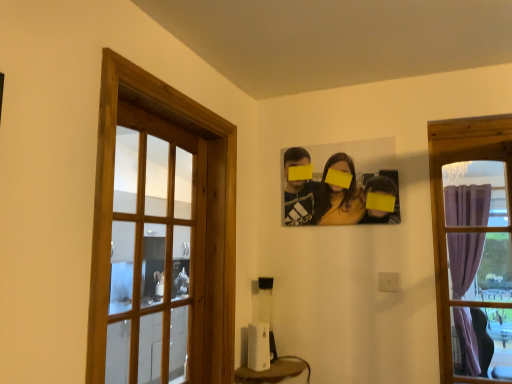
Question: From the image's perspective, is white plastic speaker at lower center located beneath purple curtain at right, the second window in the left-to-right sequence?

Choices:
 (A) yes
 (B) no

Answer: (A)

Question: From a real-world perspective, is white plastic speaker at lower center positioned over purple curtain at right, the second window in the left-to-right sequence, based on gravity?

Choices:
 (A) no
 (B) yes

Answer: (A)

Question: From a real-world perspective, is white plastic speaker at lower center beneath purple curtain at right, placed as the first window when sorted from right to left?

Choices:
 (A) yes
 (B) no

Answer: (A)

Question: Can you confirm if white plastic speaker at lower center is smaller than purple curtain at right, the second window in the left-to-right sequence?

Choices:
 (A) yes
 (B) no

Answer: (A)

Question: Is white plastic speaker at lower center wider than purple curtain at right, the second window in the left-to-right sequence?

Choices:
 (A) yes
 (B) no

Answer: (A)

Question: Is purple curtain at right, the second window in the left-to-right sequence, inside or outside of wooden frame at left, the 1th window from the left?

Choices:
 (A) outside
 (B) inside

Answer: (A)

Question: Considering the positions of purple curtain at right, placed as the first window when sorted from right to left, and wooden frame at left, the 1th window from the left, in the image, is purple curtain at right, placed as the first window when sorted from right to left, wider or thinner than wooden frame at left, the 1th window from the left,?

Choices:
 (A) thin
 (B) wide

Answer: (A)

Question: From a real-world perspective, relative to wooden frame at left, the 1th window from the left, is purple curtain at right, the second window in the left-to-right sequence, vertically above or below?

Choices:
 (A) below
 (B) above

Answer: (B)

Question: Is point (445, 147) positioned closer to the camera than point (223, 379)?

Choices:
 (A) farther
 (B) closer

Answer: (A)

Question: In the image, is white plastic speaker at lower center positioned in front of or behind purple curtain at right, the second window in the left-to-right sequence?

Choices:
 (A) front
 (B) behind

Answer: (B)

Question: Considering the positions of white plastic speaker at lower center and purple curtain at right, placed as the first window when sorted from right to left, in the image, is white plastic speaker at lower center bigger or smaller than purple curtain at right, placed as the first window when sorted from right to left,?

Choices:
 (A) big
 (B) small

Answer: (B)

Question: Considering the positions of white plastic speaker at lower center and purple curtain at right, the second window in the left-to-right sequence, in the image, is white plastic speaker at lower center taller or shorter than purple curtain at right, the second window in the left-to-right sequence,?

Choices:
 (A) short
 (B) tall

Answer: (A)

Question: From the image's perspective, is white plastic speaker at lower center located above or below purple curtain at right, the second window in the left-to-right sequence?

Choices:
 (A) below
 (B) above

Answer: (A)

Question: From a real-world perspective, is purple curtain at right, the second window in the left-to-right sequence, physically located above or below white plastic speaker at lower center?

Choices:
 (A) below
 (B) above

Answer: (B)

Question: Considering the positions of purple curtain at right, the second window in the left-to-right sequence, and white plastic speaker at lower center in the image, is purple curtain at right, the second window in the left-to-right sequence, bigger or smaller than white plastic speaker at lower center?

Choices:
 (A) small
 (B) big

Answer: (B)